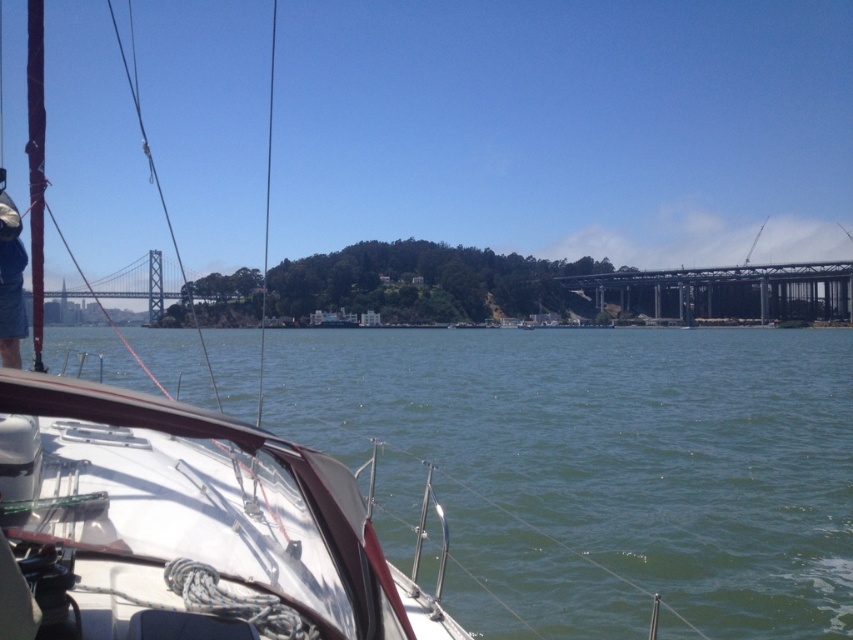
You are standing on the deck of the sailboat and see the point marked at coordinates (x=599, y=468). What is the color of the area at that point?

The point at coordinates (x=599, y=468) marks green water at lower left.

You are navigating a sailboat and need to pass under the metallic steel bridge at center. The mast of your boat is 10 meters tall. Can you safely pass under the bridge without hitting it?

The metallic steel bridge at center has a clearance height of 12 meters, so your boat with a 10 meter mast can safely pass under it without any issues.

You are standing on the deck of the sailboat and see the point marked as point (727, 291). What object does this point correspond to?

The point (727, 291) corresponds to the metallic steel bridge at center.